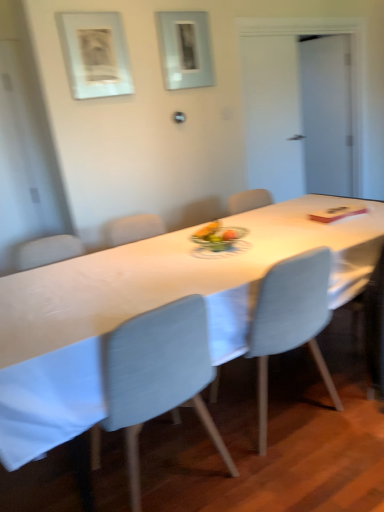
In order to click on free space on the front side of light blue fabric chair at center, placed as the first chair when sorted from right to left in this screenshot , I will do `click(311, 474)`.